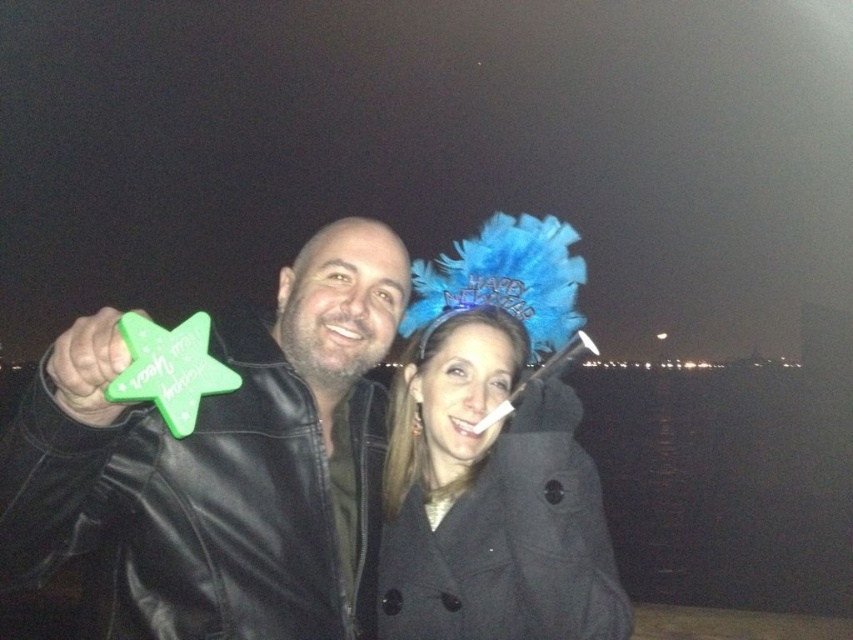
Question: Does green matte star at left appear over black wool coat at center?

Choices:
 (A) yes
 (B) no

Answer: (A)

Question: Which point appears farthest from the camera in this image?

Choices:
 (A) (515, 531)
 (B) (340, 573)

Answer: (B)

Question: Is green matte star at left thinner than black wool coat at center?

Choices:
 (A) no
 (B) yes

Answer: (A)

Question: Where is green matte star at left located in relation to black wool coat at center in the image?

Choices:
 (A) below
 (B) above

Answer: (B)